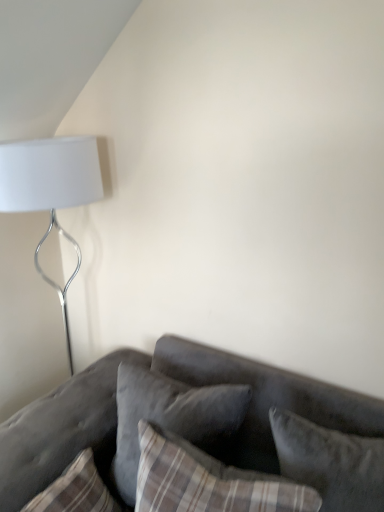
Question: Can we say velvet gray couch at lower right lies outside velvet gray pillow at center, arranged as the 2th pillow when viewed from the right?

Choices:
 (A) yes
 (B) no

Answer: (A)

Question: Does velvet gray couch at lower right have a lesser width compared to velvet gray pillow at center, arranged as the 2th pillow when viewed from the right?

Choices:
 (A) no
 (B) yes

Answer: (A)

Question: Is velvet gray couch at lower right positioned before velvet gray pillow at center, arranged as the 2th pillow when viewed from the right?

Choices:
 (A) yes
 (B) no

Answer: (A)

Question: Does velvet gray couch at lower right have a smaller size compared to velvet gray pillow at center, marked as the second pillow in a left-to-right arrangement?

Choices:
 (A) no
 (B) yes

Answer: (A)

Question: Does velvet gray couch at lower right have a greater height compared to velvet gray pillow at center, arranged as the 2th pillow when viewed from the right?

Choices:
 (A) no
 (B) yes

Answer: (B)

Question: Does velvet gray couch at lower right come behind velvet gray pillow at center, arranged as the 2th pillow when viewed from the right?

Choices:
 (A) yes
 (B) no

Answer: (B)

Question: Considering the relative sizes of velvet gray pillow at center, marked as the second pillow in a left-to-right arrangement, and plaid fabric pillow at lower left, which ranks as the third pillow in right-to-left order, in the image provided, is velvet gray pillow at center, marked as the second pillow in a left-to-right arrangement, shorter than plaid fabric pillow at lower left, which ranks as the third pillow in right-to-left order,?

Choices:
 (A) no
 (B) yes

Answer: (A)

Question: Considering the relative sizes of velvet gray pillow at center, arranged as the 2th pillow when viewed from the right, and plaid fabric pillow at lower left, which is the first pillow from left to right, in the image provided, is velvet gray pillow at center, arranged as the 2th pillow when viewed from the right, taller than plaid fabric pillow at lower left, which is the first pillow from left to right,?

Choices:
 (A) no
 (B) yes

Answer: (B)

Question: Is velvet gray pillow at center, arranged as the 2th pillow when viewed from the right, closer to the viewer compared to plaid fabric pillow at lower left, which is the first pillow from left to right?

Choices:
 (A) no
 (B) yes

Answer: (A)

Question: From a real-world perspective, does velvet gray pillow at center, arranged as the 2th pillow when viewed from the right, sit lower than plaid fabric pillow at lower left, which is the first pillow from left to right?

Choices:
 (A) no
 (B) yes

Answer: (A)

Question: Is the depth of velvet gray pillow at center, arranged as the 2th pillow when viewed from the right, greater than that of plaid fabric pillow at lower left, which is the first pillow from left to right?

Choices:
 (A) no
 (B) yes

Answer: (B)

Question: Considering the relative positions of velvet gray pillow at center, marked as the second pillow in a left-to-right arrangement, and plaid fabric pillow at lower left, which is the first pillow from left to right, in the image provided, is velvet gray pillow at center, marked as the second pillow in a left-to-right arrangement, to the right of plaid fabric pillow at lower left, which is the first pillow from left to right, from the viewer's perspective?

Choices:
 (A) yes
 (B) no

Answer: (A)

Question: Is velvet gray couch at lower right smaller than plaid fabric pillow at lower left, which ranks as the third pillow in right-to-left order?

Choices:
 (A) yes
 (B) no

Answer: (B)